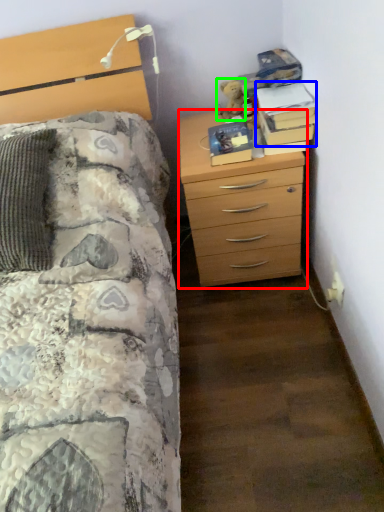
Question: Based on their relative distances, which object is farther from chest of drawers (highlighted by a red box)? Choose from book (highlighted by a blue box) and teddy (highlighted by a green box).

Choices:
 (A) book
 (B) teddy

Answer: (B)